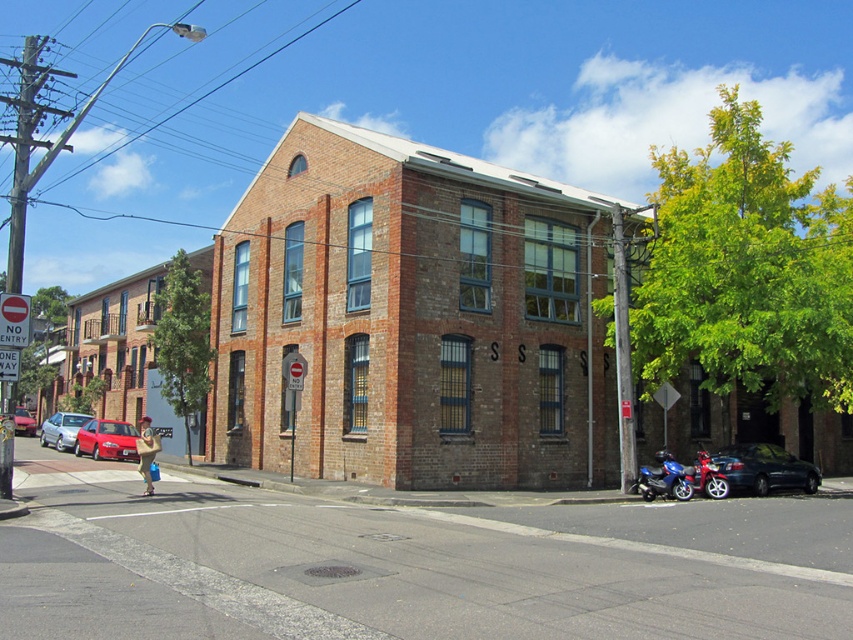
You are a delivery driver who needs to park your vehicle between the shiny red car at center and the blue metallic motorcycle at lower right. Your vehicle is 2 meters wide. Can you fit your vehicle between them?

The shiny red car at center is wider than the blue metallic motorcycle at lower right, but the description does not provide specific measurements of the distance between them. Therefore, it is unclear if there is enough space to park a 2 meter wide vehicle between them.

You are a pedestrian standing on the sidewalk in front of the two story brick building. You see a shiny red car at center and a blue metallic motorcycle at lower right. Which vehicle is closer to you?

The shiny red car at center is closer to you because the blue metallic motorcycle at lower right is behind it.

You are a delivery person who needs to park your vehicle on the street. You have a shiny black sedan at lower right and a metallic blue motorcycle at lower right. Which vehicle is closer to the sidewalk where the person is walking?

The metallic blue motorcycle at lower right is closer to the sidewalk where the person is walking because the shiny black sedan at lower right is positioned to its right, meaning the motorcycle is nearer to the sidewalk.